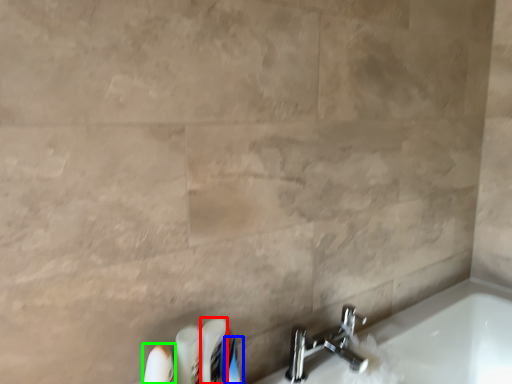
Question: Which object is positioned closest to toiletry (highlighted by a red box)? Select from toiletry (highlighted by a blue box) and toiletry (highlighted by a green box).

Choices:
 (A) toiletry
 (B) toiletry

Answer: (A)